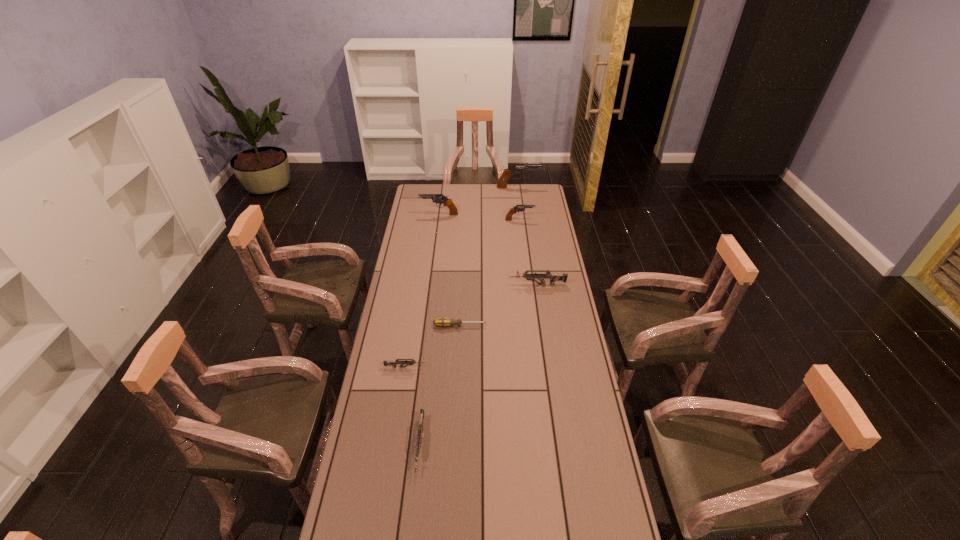
This screenshot has height=540, width=960. In order to click on free space located aimed along the barrel of the second farthest grey gun in this screenshot , I will do `click(519, 367)`.

Locate an element on the screen. This screenshot has height=540, width=960. vacant region located at the tip of the gray screwdriver is located at coordinates (505, 326).

Locate an element on the screen. object that is at the far edge is located at coordinates (507, 173).

Identify the location of object situated at the far right corner. This screenshot has width=960, height=540. (507, 173).

The width and height of the screenshot is (960, 540). I want to click on vacant space at the left edge, so click(x=421, y=315).

Identify the location of free spot at the right edge of the desktop. (559, 272).

This screenshot has width=960, height=540. Find the location of `vacant point located between the fifth shortest object and the rightmost grey gun`. vacant point located between the fifth shortest object and the rightmost grey gun is located at coordinates (529, 252).

I want to click on free spot between the farthest object and the fourth shortest gun, so click(x=519, y=204).

The image size is (960, 540). I want to click on vacant space in between the farthest object and the rightmost grey gun, so tap(528, 236).

You are a GUI agent. You are given a task and a screenshot of the screen. Output one action in this format:
    pyautogui.click(x=<x>, y=<y>)
    Task: Click on the unoccupied area between the second nearest object and the biggest black gun
    Image resolution: width=960 pixels, height=540 pixels.
    Given the screenshot: What is the action you would take?
    pyautogui.click(x=462, y=277)